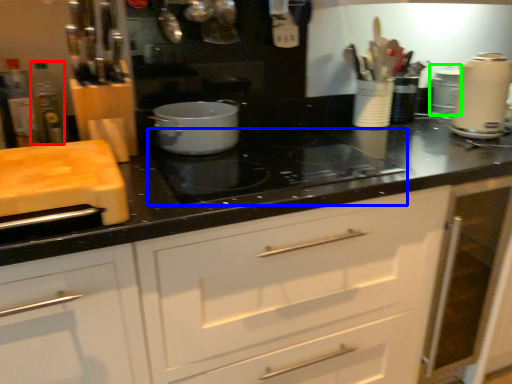
Question: Based on their relative distances, which object is nearer to bottle (highlighted by a red box)? Choose from gas stove (highlighted by a blue box) and appliance (highlighted by a green box).

Choices:
 (A) gas stove
 (B) appliance

Answer: (A)